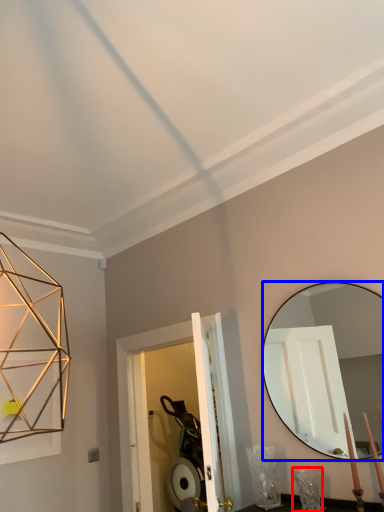
Question: Among these objects, which one is nearest to the camera, table lamp (highlighted by a red box) or mirror (highlighted by a blue box)?

Choices:
 (A) table lamp
 (B) mirror

Answer: (B)